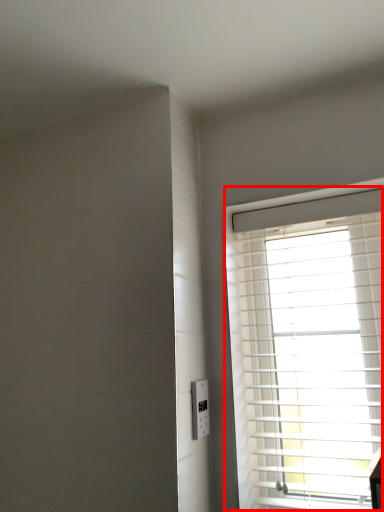
Question: From the image's perspective, where is window (annotated by the red box) located relative to electric outlet?

Choices:
 (A) below
 (B) above

Answer: (B)